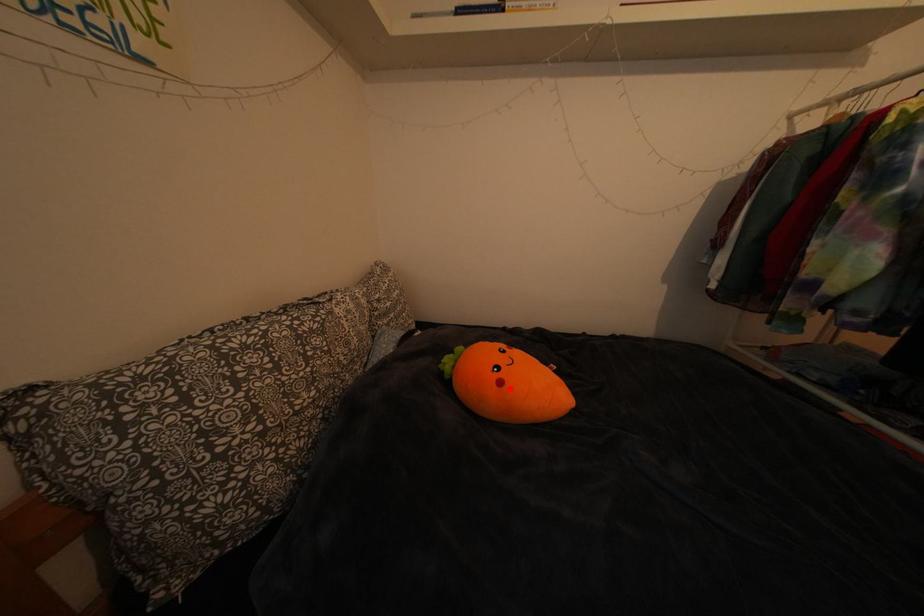
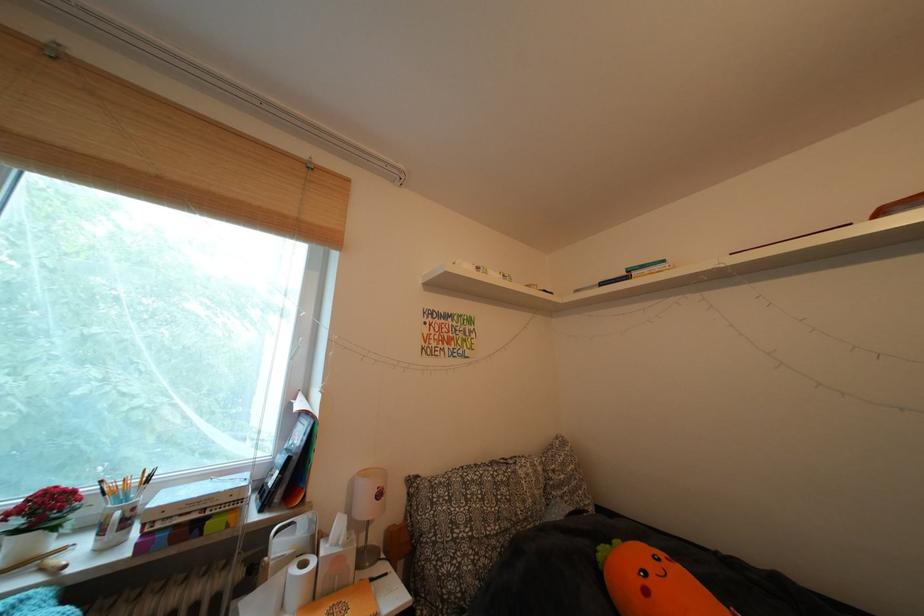
In the second image, find the point that corresponds to the highlighted location in the first image.

(657, 597)